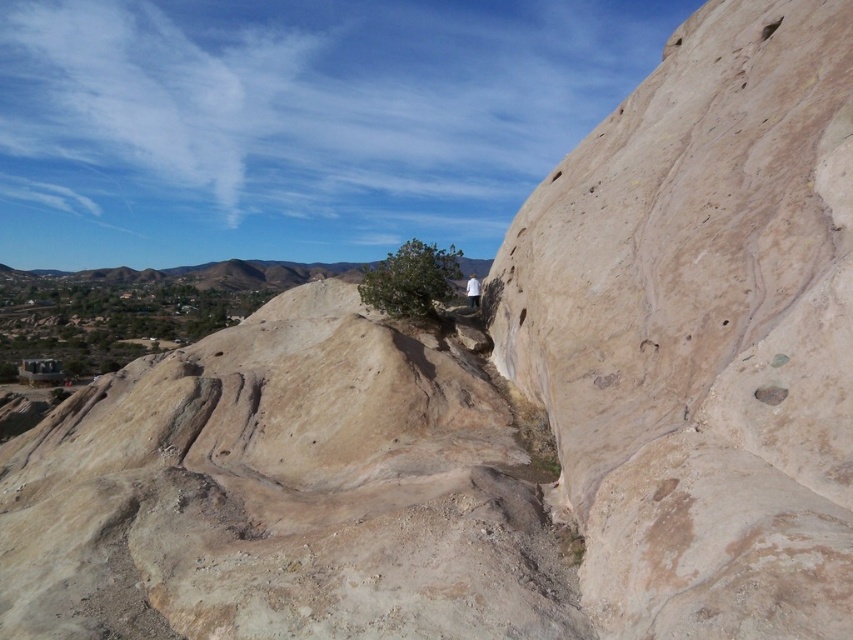
You are a hiker trying to navigate through the desert. You see the beige rock cliff at center right and the smooth beige rock at center. Which one would you have to look up more to see clearly?

The beige rock cliff at center right is taller than the smooth beige rock at center, so you would have to look up more to see the beige rock cliff at center right clearly.

You are a hiker trying to navigate between the beige rock cliff at center right and the smooth beige rock at center. Based on their positions, which direction should you move to go from the higher elevation to the lower elevation?

The beige rock cliff at center right is above the smooth beige rock at center, so to move from higher to lower elevation, you should go downward towards the smooth beige rock at center.